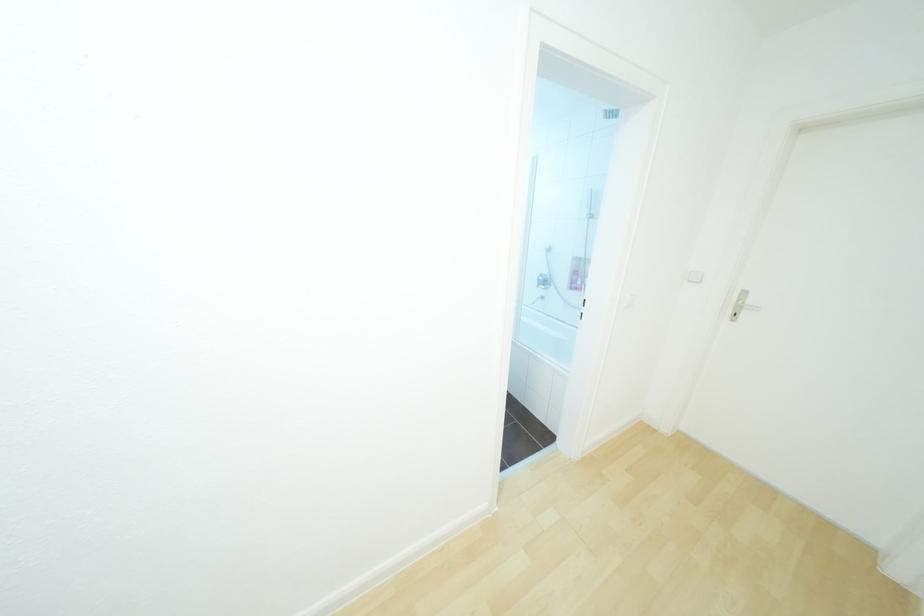
The image size is (924, 616). In order to click on pink bottle in this screenshot , I will do `click(577, 276)`.